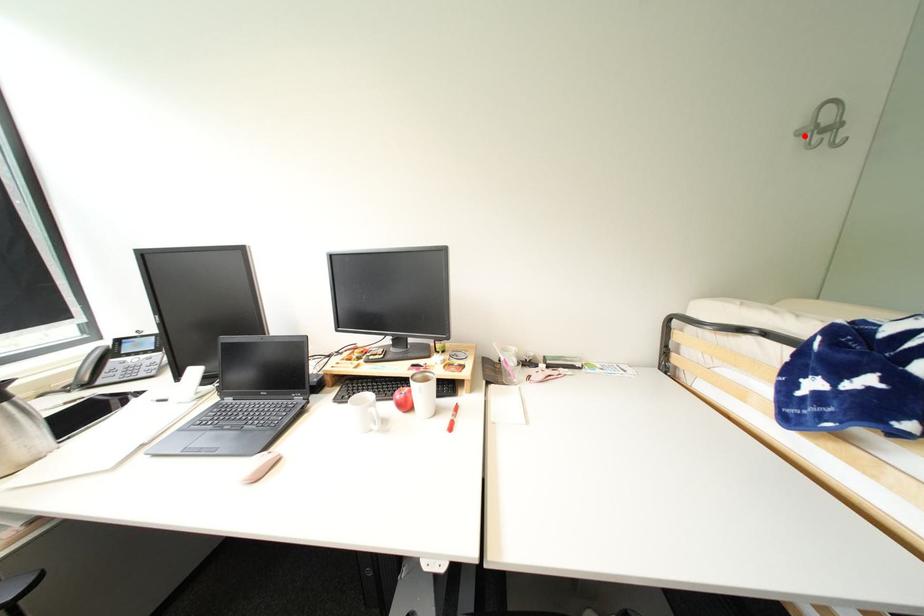
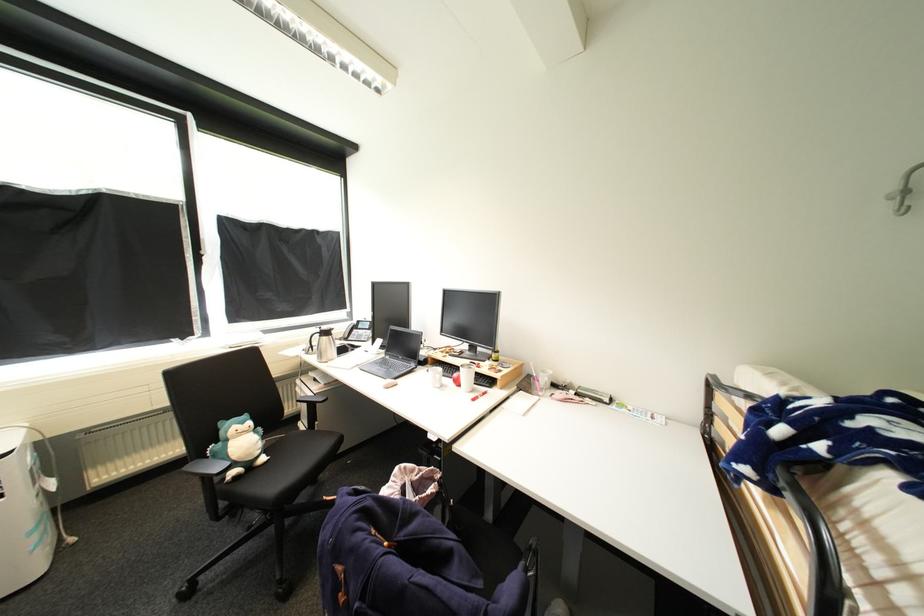
Where in the second image is the point corresponding to the highlighted location from the first image?

(900, 199)